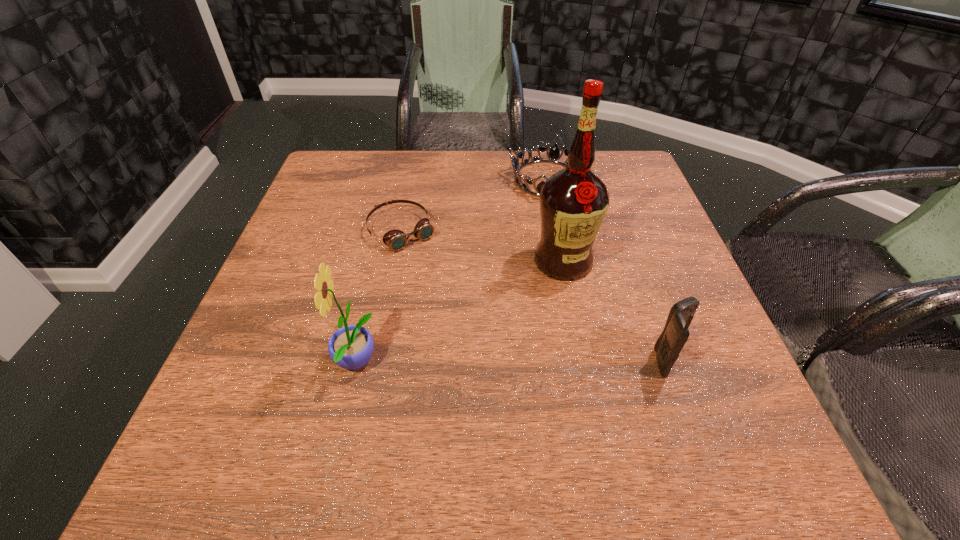
The height and width of the screenshot is (540, 960). What are the coordinates of `object located in the far edge section of the desktop` in the screenshot? It's located at (554, 155).

I want to click on sunflower at the near edge, so click(x=350, y=347).

The width and height of the screenshot is (960, 540). I want to click on cellular telephone that is at the near edge, so click(x=668, y=346).

The height and width of the screenshot is (540, 960). What are the coordinates of `cellular telephone present at the right edge` in the screenshot? It's located at (668, 346).

The width and height of the screenshot is (960, 540). In order to click on tiara that is at the right edge in this screenshot , I will do `click(554, 155)`.

The height and width of the screenshot is (540, 960). In order to click on object that is at the far right corner in this screenshot , I will do `click(554, 155)`.

This screenshot has width=960, height=540. In order to click on object that is at the near right corner in this screenshot , I will do `click(668, 346)`.

You are a GUI agent. You are given a task and a screenshot of the screen. Output one action in this format:
    pyautogui.click(x=<x>, y=<y>)
    Task: Click on the vacant region at the far edge of the desktop
    The height and width of the screenshot is (540, 960).
    Given the screenshot: What is the action you would take?
    pyautogui.click(x=404, y=178)

The width and height of the screenshot is (960, 540). I want to click on vacant space at the near edge of the desktop, so click(652, 407).

At what (x,y) coordinates should I click in order to perform the action: click on free space at the left edge of the desktop. Please return your answer as a coordinate pair (x, y). Image resolution: width=960 pixels, height=540 pixels. Looking at the image, I should click on [x=335, y=269].